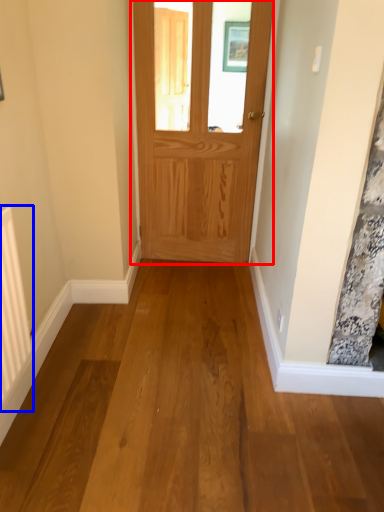
Question: Which object is closer to the camera taking this photo, door (highlighted by a red box) or radiator (highlighted by a blue box)?

Choices:
 (A) door
 (B) radiator

Answer: (B)